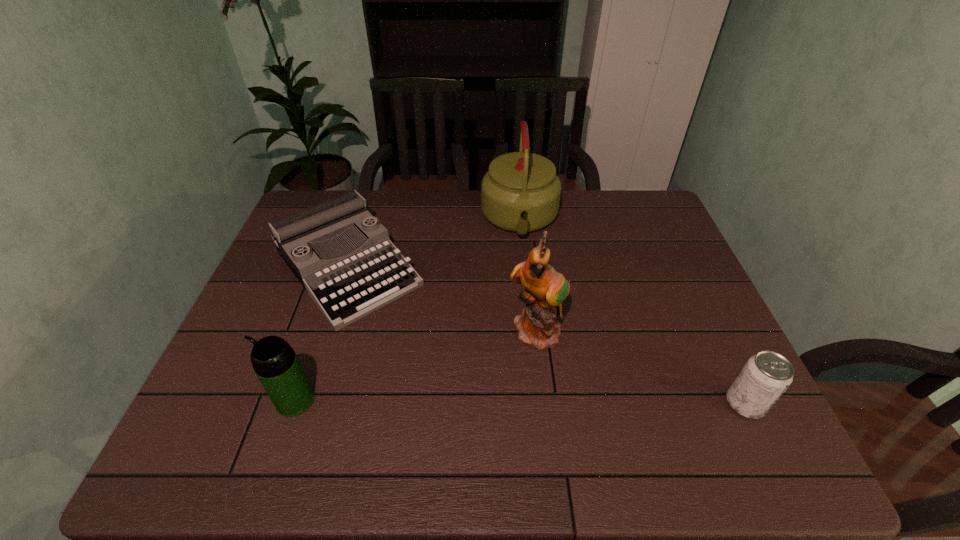
Locate an element on the screen. free space between the thermos bottle and the rightmost object is located at coordinates (520, 402).

I want to click on vacant point located between the typewriter and the parrot, so click(x=443, y=300).

This screenshot has height=540, width=960. What are the coordinates of `free space between the parrot and the rightmost object` in the screenshot? It's located at (641, 368).

You are a GUI agent. You are given a task and a screenshot of the screen. Output one action in this format:
    pyautogui.click(x=<x>, y=<y>)
    Task: Click on the free space between the kettle and the third shortest object
    The image size is (960, 540).
    Given the screenshot: What is the action you would take?
    [408, 310]

Locate an element on the screen. vacant area between the typewriter and the kettle is located at coordinates (434, 244).

Find the location of `free space between the kettle and the typewriter`. free space between the kettle and the typewriter is located at coordinates (434, 244).

Where is `vacant space in between the thermos bottle and the kettle`? This screenshot has width=960, height=540. vacant space in between the thermos bottle and the kettle is located at coordinates (408, 310).

Select which object appears as the closest to the thermos bottle. Please provide its 2D coordinates. Your answer should be formatted as a tuple, i.e. [(x, y)], where the tuple contains the x and y coordinates of a point satisfying the conditions above.

[(346, 285)]

Point out which object is positioned as the nearest to the typewriter. Please provide its 2D coordinates. Your answer should be formatted as a tuple, i.e. [(x, y)], where the tuple contains the x and y coordinates of a point satisfying the conditions above.

[(274, 361)]